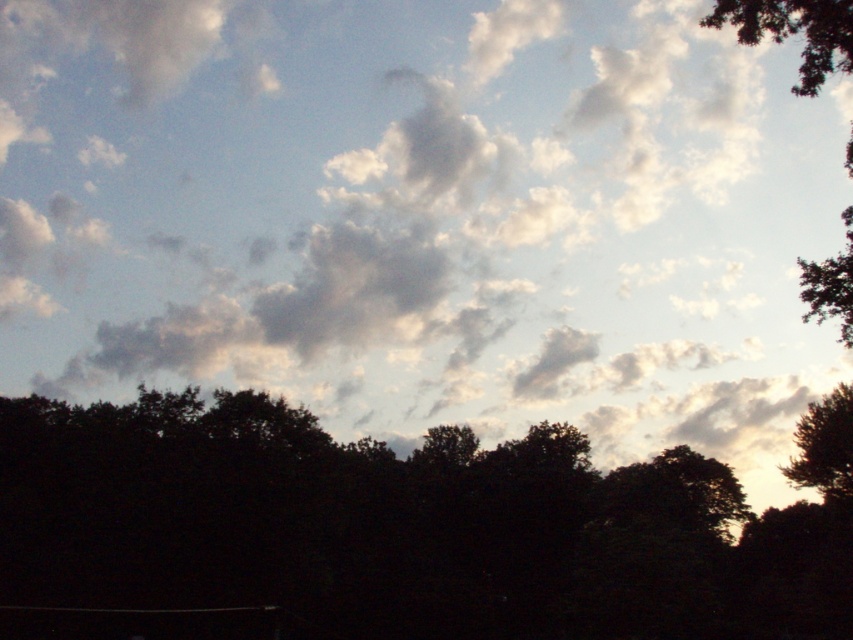
Question: Which point is closer to the camera taking this photo?

Choices:
 (A) (807, 433)
 (B) (97, 243)

Answer: (A)

Question: Which object is the farthest from the silhouette leafy tree at right?

Choices:
 (A) green leafy tree at upper right
 (B) white fluffy cloud at upper center

Answer: (B)

Question: Which object appears closest to the camera in this image?

Choices:
 (A) dark green leafy tree at center
 (B) white fluffy cloud at upper center
 (C) silhouette leafy tree at right
 (D) green leafy tree at upper right

Answer: (D)

Question: Does green leafy tree at upper right have a smaller size compared to silhouette leafy tree at right?

Choices:
 (A) no
 (B) yes

Answer: (A)

Question: From the image, what is the correct spatial relationship of dark green leafy tree at center in relation to green leafy tree at upper right?

Choices:
 (A) above
 (B) below

Answer: (B)

Question: In this image, where is white fluffy cloud at upper center located relative to silhouette leafy tree at right?

Choices:
 (A) above
 (B) below

Answer: (A)